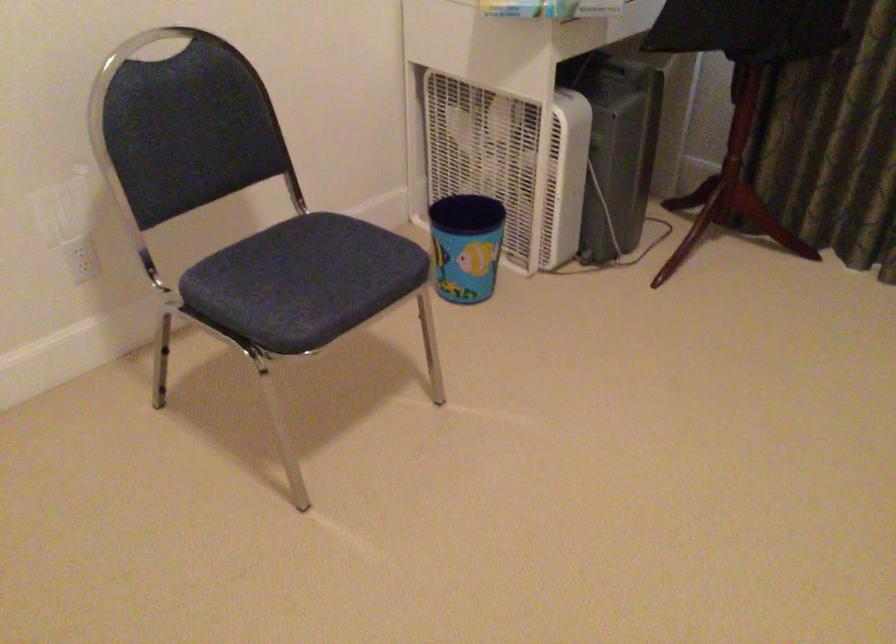
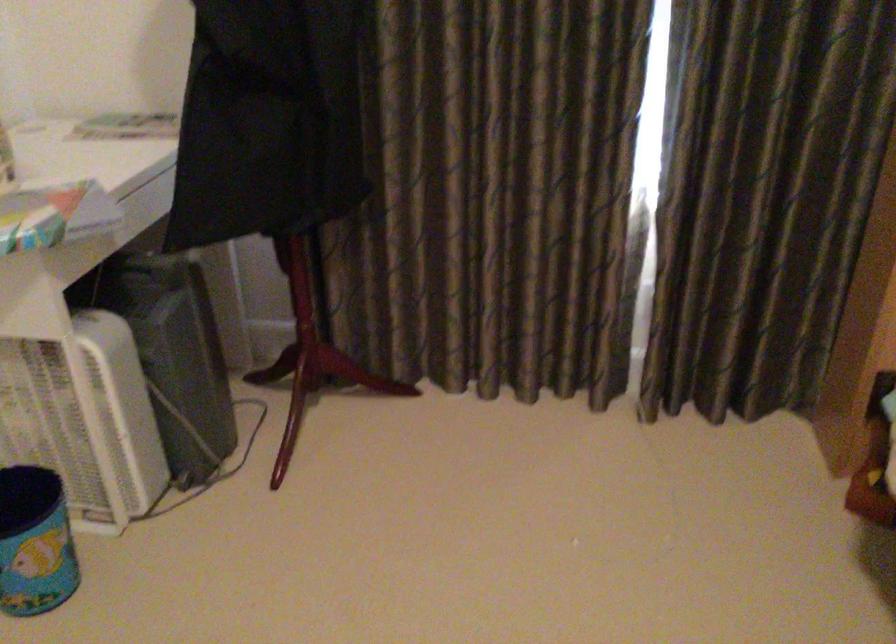
Locate, in the second image, the point that corresponds to pixel 474 243 in the first image.

(35, 542)